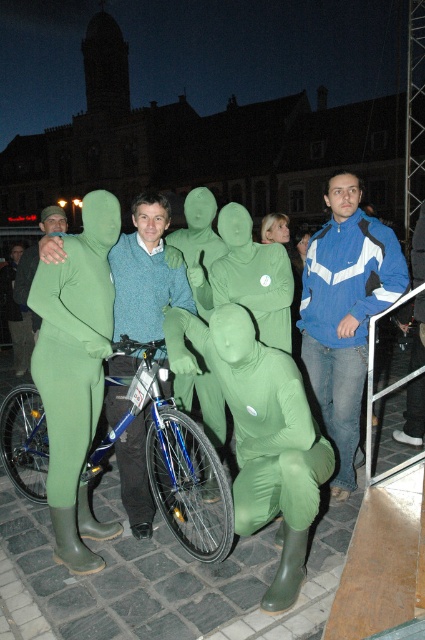
You are a photographer trying to capture a photo of the green rubber suit at left and the knitted sweater at center. Based on their positions, which object should you focus on first if you want to capture them both in the same frame without moving the camera?

The green rubber suit at left should be focused on first since it is positioned to the left of the knitted sweater at center, allowing the photographer to adjust the camera to include both in the frame by centering on the leftmost object first.

You are standing in the nighttime square and see the green rubber suit at left and the knitted sweater at center. Which clothing item is positioned higher from the ground?

The green rubber suit at left is above the knitted sweater at center, so it is positioned higher from the ground.